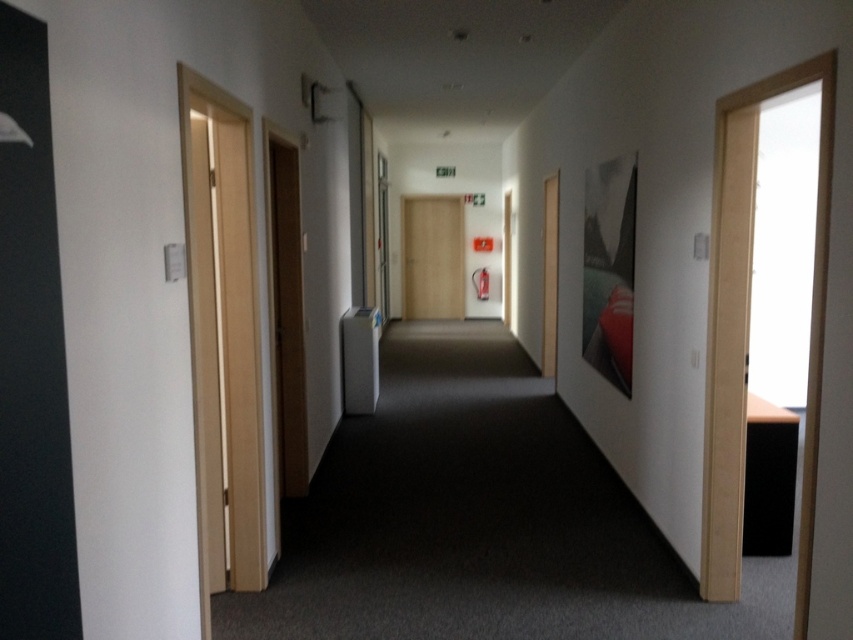
Is light wood door at left above wooden door at center?

Actually, light wood door at left is below wooden door at center.

Which is in front, point (183, 156) or point (447, 273)?

Point (183, 156)

This screenshot has width=853, height=640. I want to click on light wood door at left, so click(223, 330).